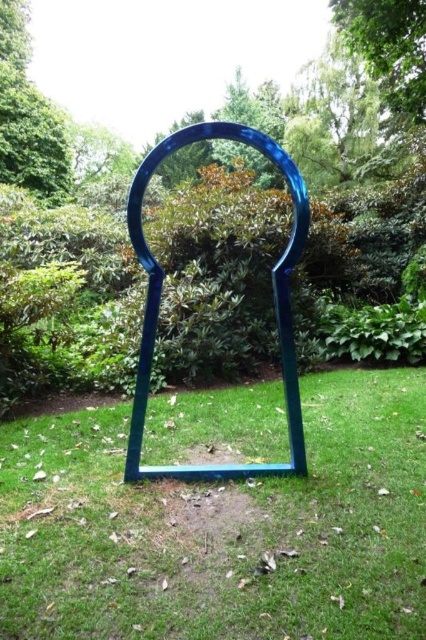
You are an artist planning to install a new sculpture in the garden. You want to place a new sculpture that is 3 meters wide between the blue glass frame at center and the green leafy tree at center. Is there enough space between them to fit the sculpture without it touching either object?

The blue glass frame at center and green leafy tree at center are 12.32 meters apart from each other. Since the new sculpture is only 3 meters wide, there is ample space between them to fit it without touching either object.

You are an artist planning to photograph the blue glass frame at center and the green leafy tree at upper center. Which object is casting a shadow on the other?

The green leafy tree at upper center is casting a shadow on the blue glass frame at center because it is positioned above it.